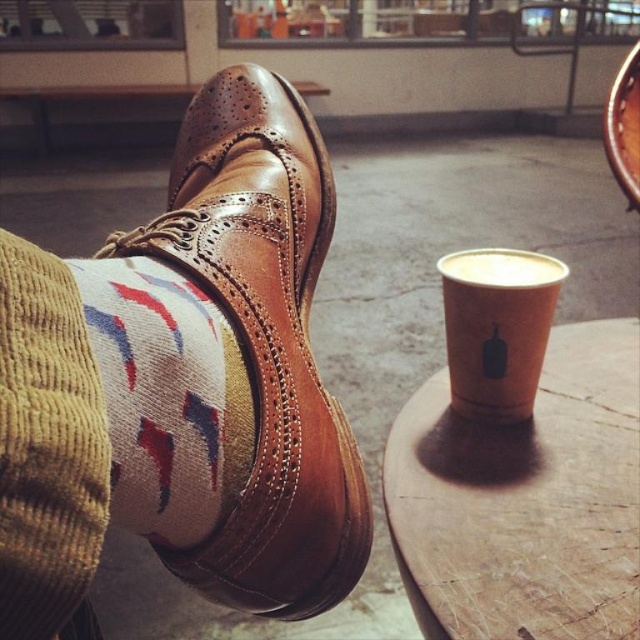
Is white paper cup at center right positioned at the back of white matte cup at center?

No, white paper cup at center right is in front of white matte cup at center.

Is white paper cup at center right thinner than white matte cup at center?

Yes, white paper cup at center right is thinner than white matte cup at center.

Which is behind, point (499, 403) or point (538, 266)?

Positioned behind is point (538, 266).

This screenshot has height=640, width=640. What are the coordinates of `white paper cup at center right` in the screenshot? It's located at (497, 328).

Is brown leather shoe at center closer to the viewer compared to white matte cup at center?

That is True.

Which is more to the right, brown leather shoe at center or white matte cup at center?

Positioned to the right is white matte cup at center.

Does point (218, 227) come behind point (464, 262)?

No, it is in front of (464, 262).

Where is `brown leather shoe at center`? This screenshot has width=640, height=640. brown leather shoe at center is located at coordinates (264, 342).

Can you confirm if corduroy socks at lower left is positioned to the left of white matte cup at center?

Yes, corduroy socks at lower left is to the left of white matte cup at center.

Is corduroy socks at lower left above white matte cup at center?

Incorrect, corduroy socks at lower left is not positioned above white matte cup at center.

At what (x,y) coordinates should I click in order to perform the action: click on corduroy socks at lower left. Please return your answer as a coordinate pair (x, y). Looking at the image, I should click on (161, 394).